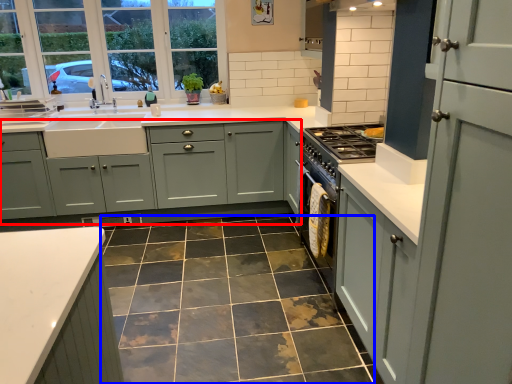
Question: Which of the following is the closest to the observer, cabinetry (highlighted by a red box) or ceramic tile (highlighted by a blue box)?

Choices:
 (A) cabinetry
 (B) ceramic tile

Answer: (B)